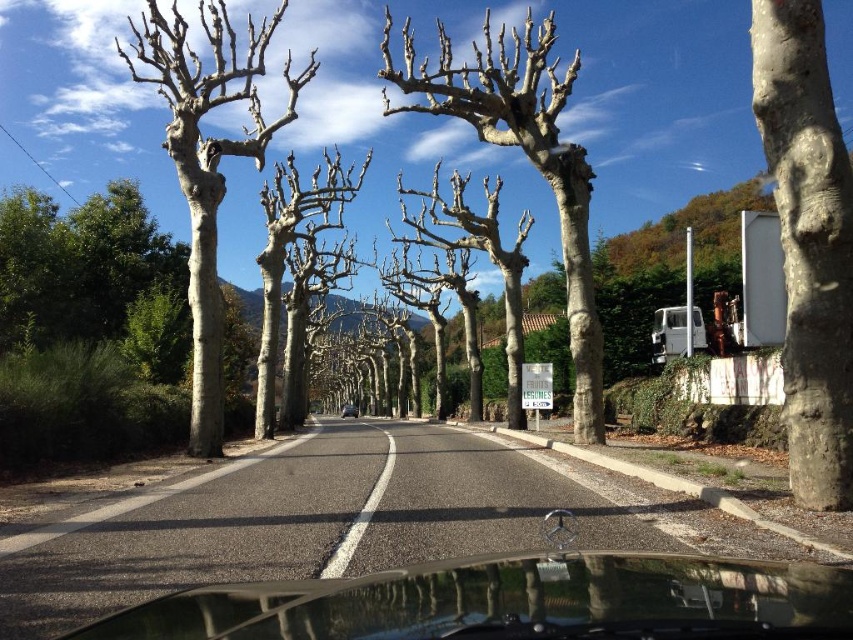
You are driving a car and looking out the windshield. You see two points marked on the road ahead. The first point is at coordinates point (x=775, y=93) and the second is at point (x=573, y=323). Which point is closer to your current position?

Point (x=775, y=93) is in front of point (x=573, y=323), so the point closer to your current position is point (x=573, y=323).

You are a passenger in the car and looking out. You see the transparent glass windshield at center and the smooth white tree at center. Which object is taller from your viewpoint?

The smooth white tree at center is taller than the transparent glass windshield at center.

You are sitting in the driver seat of the car shown in the image. You notice a point at coordinates (514,602). What object is located at that point?

The point at coordinates (514,602) indicates the transparent glass windshield at center.